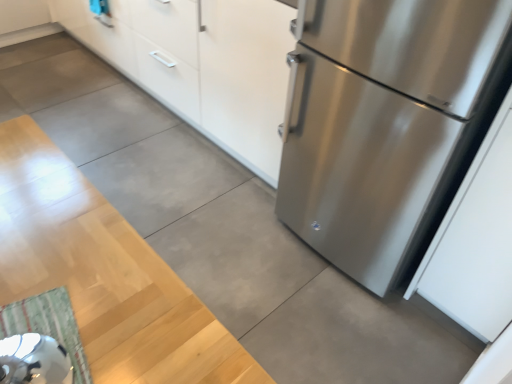
Locate an element on the screen. vacant area to the right of green striped rug at lower left is located at coordinates (152, 328).